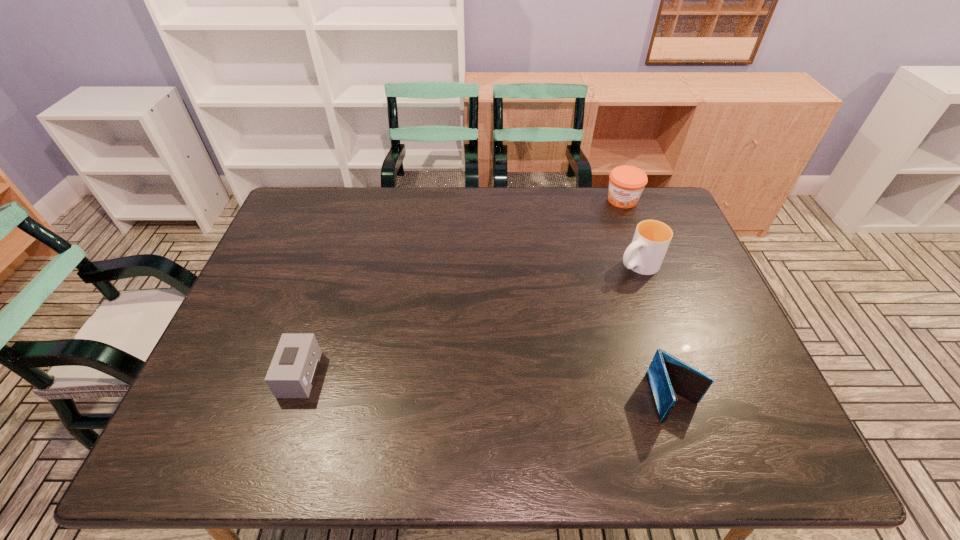
This screenshot has height=540, width=960. Identify the location of object at the far right corner. (626, 183).

This screenshot has height=540, width=960. What are the coordinates of `object at the near right corner` in the screenshot? It's located at (667, 375).

Locate an element on the screen. vacant space at the far edge is located at coordinates (516, 192).

At what (x,y) coordinates should I click in order to perform the action: click on free region at the near edge. Please return your answer as a coordinate pair (x, y). The image size is (960, 540). Looking at the image, I should click on click(x=483, y=384).

You are a GUI agent. You are given a task and a screenshot of the screen. Output one action in this format:
    pyautogui.click(x=<x>, y=<y>)
    Task: Click on the vacant space at the left edge
    The width and height of the screenshot is (960, 540).
    Given the screenshot: What is the action you would take?
    pyautogui.click(x=288, y=274)

This screenshot has width=960, height=540. Identify the location of free space at the right edge of the desktop. (687, 325).

Identify the location of vacant space at the far left corner. (309, 226).

You are a GUI agent. You are given a task and a screenshot of the screen. Output one action in this format:
    pyautogui.click(x=<x>, y=<y>)
    Task: Click on the vacant space at the far right corner of the desktop
    The width and height of the screenshot is (960, 540).
    Given the screenshot: What is the action you would take?
    pyautogui.click(x=668, y=212)

In the image, there is a desktop. Where is `free space at the near right corner`? Image resolution: width=960 pixels, height=540 pixels. free space at the near right corner is located at coordinates (752, 382).

Where is `free space between the wallet and the farthest object`? The width and height of the screenshot is (960, 540). free space between the wallet and the farthest object is located at coordinates (648, 299).